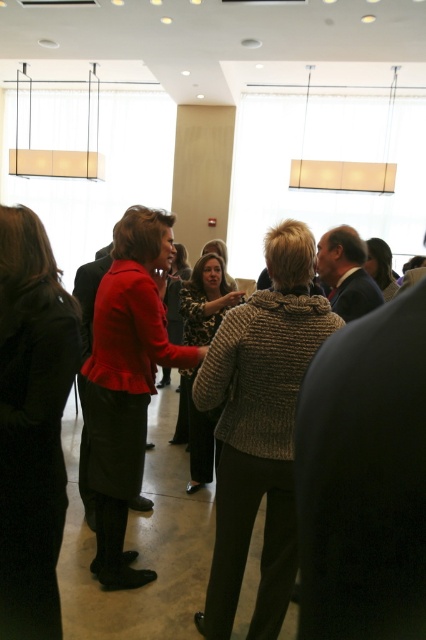
Does camouflage-patterned sweater at center have a smaller size compared to dark brown textured sweater at center?

Incorrect, camouflage-patterned sweater at center is not smaller in size than dark brown textured sweater at center.

Does camouflage-patterned sweater at center appear over dark brown textured sweater at center?

No.

Which is behind, point (209, 436) or point (379, 260)?

The point (209, 436) is more distant.

Identify the location of camouflage-patterned sweater at center. This screenshot has width=426, height=640. coord(206,300).

Can you confirm if knitted sweater at center is bigger than dark brown textured sweater at center?

Indeed, knitted sweater at center has a larger size compared to dark brown textured sweater at center.

This screenshot has width=426, height=640. What do you see at coordinates (259, 429) in the screenshot? I see `knitted sweater at center` at bounding box center [259, 429].

Who is more forward, (285, 253) or (391, 266)?

Point (285, 253) is in front.

Find the location of a particular element. The width and height of the screenshot is (426, 640). knitted sweater at center is located at coordinates (259, 429).

How far apart are black wool coat at left and dark brown textured sweater at center?

1.91 meters

Does black wool coat at left appear over dark brown textured sweater at center?

No, black wool coat at left is not above dark brown textured sweater at center.

Which is in front, point (28, 310) or point (368, 253)?

Point (28, 310) is more forward.

Identify the location of black wool coat at left. (31, 424).